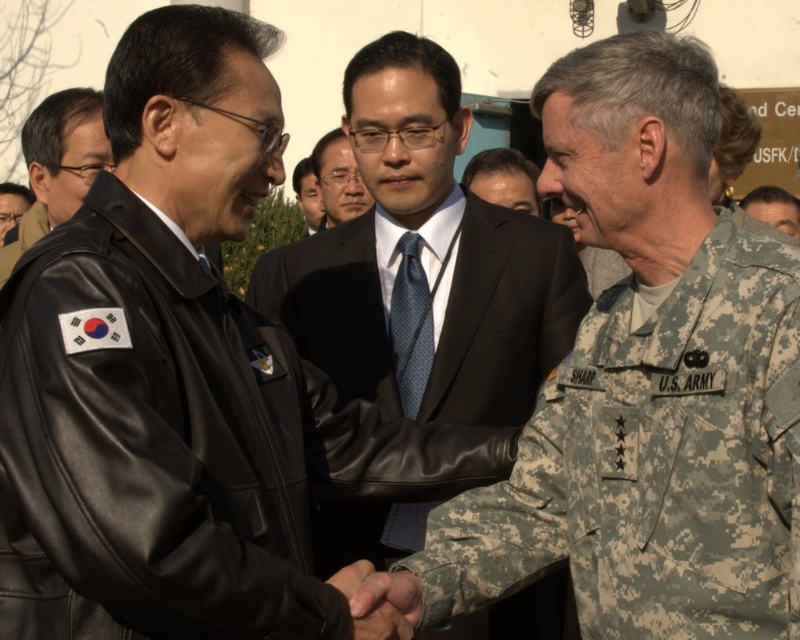
Is blue dotted fabric tie at center behind dark suit at center?

That is False.

Does point (418, 324) come behind point (310, 221)?

No, it is not.

The image size is (800, 640). Identify the location of blue dotted fabric tie at center. (410, 324).

Is leather jacket at left above dark suit at center?

Actually, leather jacket at left is below dark suit at center.

Which is in front, point (106, 157) or point (306, 161)?

Positioned in front is point (106, 157).

Is point (73, 150) behind point (297, 182)?

No, it is in front of (297, 182).

Identify the location of leather jacket at left. The height and width of the screenshot is (640, 800). (58, 164).

Between matte black suit at center and camouflage uniform at center, which one has more height?

Standing taller between the two is camouflage uniform at center.

Can you confirm if matte black suit at center is wider than camouflage uniform at center?

In fact, matte black suit at center might be narrower than camouflage uniform at center.

Find the location of a particular element. This screenshot has height=640, width=800. matte black suit at center is located at coordinates (337, 179).

You are a GUI agent. You are given a task and a screenshot of the screen. Output one action in this format:
    pyautogui.click(x=<x>, y=<y>)
    Task: Click on the matte black suit at center
    The image size is (800, 640).
    Given the screenshot: What is the action you would take?
    tap(337, 179)